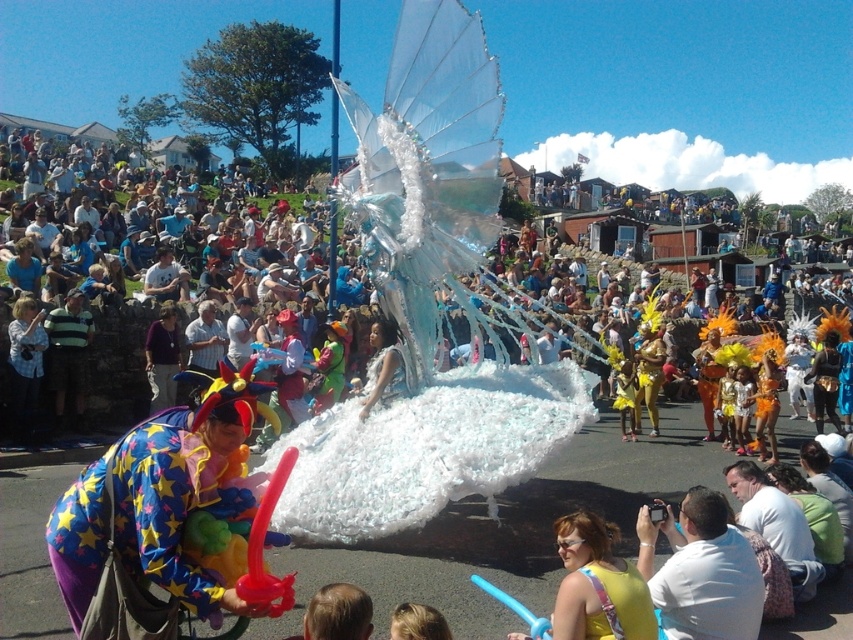
Is rubber clown toy at lower left bigger than white matte balloon at center?

Yes, rubber clown toy at lower left is bigger than white matte balloon at center.

Does rubber clown toy at lower left appear over white matte balloon at center?

Correct, rubber clown toy at lower left is located above white matte balloon at center.

Is point (152, 502) positioned after point (683, 573)?

No, it is not.

Locate an element on the screen. This screenshot has height=640, width=853. rubber clown toy at lower left is located at coordinates (169, 502).